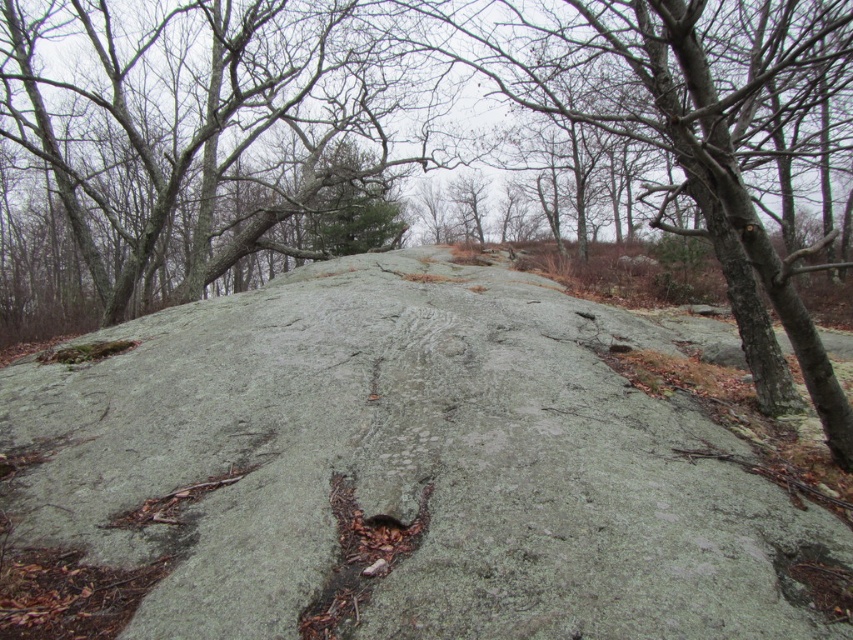
Is point (648, 406) less distant than point (260, 72)?

That is True.

This screenshot has height=640, width=853. Identify the location of gray rough rock at center. (393, 474).

You are a GUI agent. You are given a task and a screenshot of the screen. Output one action in this format:
    pyautogui.click(x=<x>, y=<y>)
    Task: Click on the gray rough rock at center
    
    Given the screenshot: What is the action you would take?
    pyautogui.click(x=393, y=474)